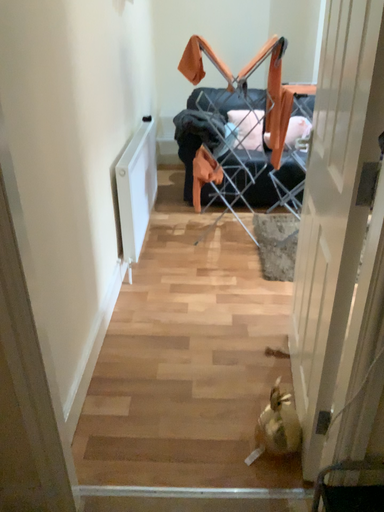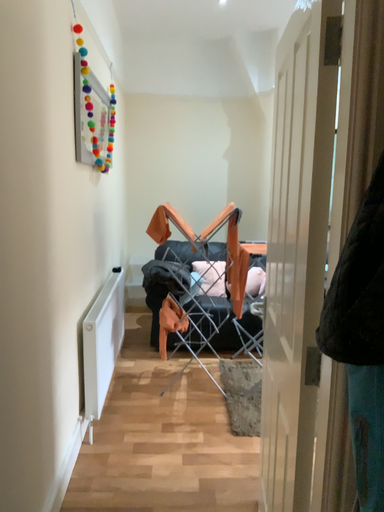
Question: Which way did the camera rotate in the video?

Choices:
 (A) rotated upward
 (B) rotated downward

Answer: (A)